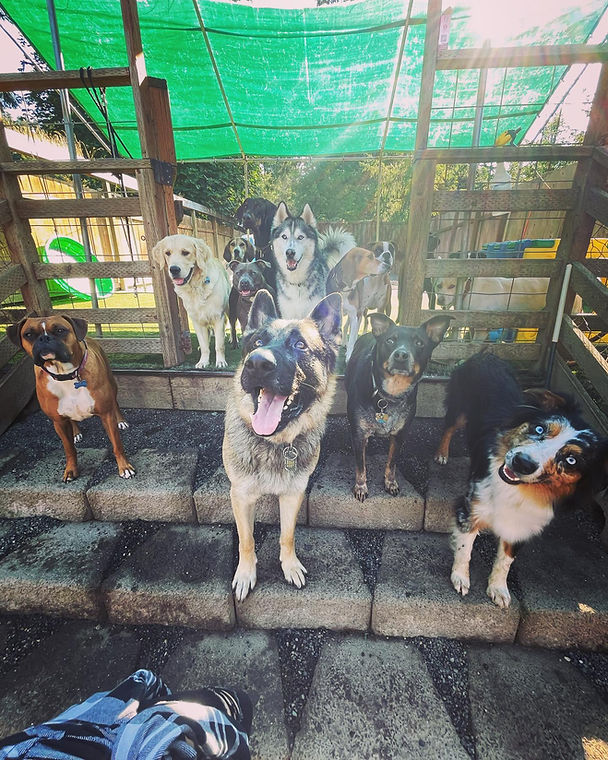
Image resolution: width=608 pixels, height=760 pixels. In order to click on wooden barrier, right side center in this screenshot , I will do `click(534, 46)`, `click(540, 159)`, `click(533, 190)`, `click(534, 249)`, `click(572, 290)`, `click(485, 318)`.